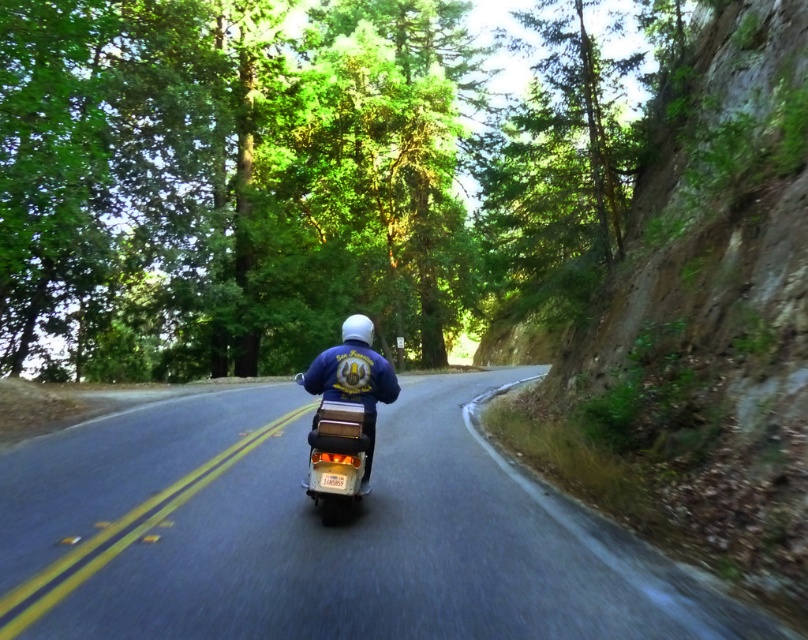
Question: Is black asphalt road at center to the left of metallic silver motorcycle at center from the viewer's perspective?

Choices:
 (A) yes
 (B) no

Answer: (A)

Question: Can you confirm if metallic silver motorcycle at center is smaller than blue denim jacket at center?

Choices:
 (A) no
 (B) yes

Answer: (A)

Question: Is black asphalt road at center positioned at the back of blue denim jacket at center?

Choices:
 (A) no
 (B) yes

Answer: (A)

Question: Which object is closer to the camera taking this photo?

Choices:
 (A) metallic silver motorcycle at center
 (B) black asphalt road at center
 (C) blue denim jacket at center

Answer: (B)

Question: Which point appears farthest from the camera in this image?

Choices:
 (A) (158, 458)
 (B) (325, 436)

Answer: (A)

Question: Which object appears farthest from the camera in this image?

Choices:
 (A) metallic silver motorcycle at center
 (B) black asphalt road at center
 (C) blue denim jacket at center

Answer: (C)